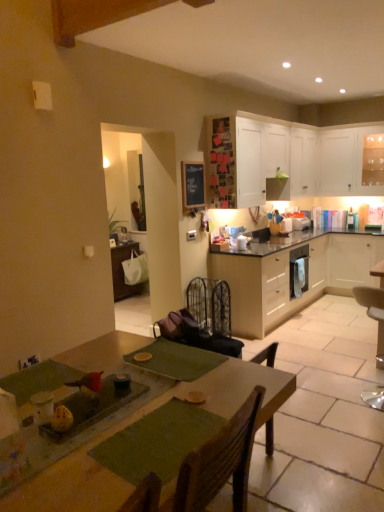
Question: Can you confirm if white glossy microwave at upper right, which is the first appliance in front-to-back order, is taller than white matte cabinet at right, the 3th cabinetry viewed from the top?

Choices:
 (A) yes
 (B) no

Answer: (B)

Question: Considering the relative sizes of white glossy microwave at upper right, which is counted as the second appliance, starting from the back, and white matte cabinet at right, which appears as the second cabinetry when ordered from the bottom, in the image provided, is white glossy microwave at upper right, which is counted as the second appliance, starting from the back, thinner than white matte cabinet at right, which appears as the second cabinetry when ordered from the bottom,?

Choices:
 (A) yes
 (B) no

Answer: (A)

Question: Would you say white glossy microwave at upper right, which is counted as the second appliance, starting from the back, contains white matte cabinet at right, which appears as the second cabinetry when ordered from the bottom?

Choices:
 (A) yes
 (B) no

Answer: (B)

Question: Is white glossy microwave at upper right, which is the first appliance in front-to-back order, bigger than white matte cabinet at right, the 3th cabinetry viewed from the top?

Choices:
 (A) no
 (B) yes

Answer: (A)

Question: Is the position of white glossy microwave at upper right, which is counted as the second appliance, starting from the back, more distant than that of white matte cabinet at right, the 3th cabinetry viewed from the top?

Choices:
 (A) no
 (B) yes

Answer: (B)

Question: Is point (345, 292) positioned closer to the camera than point (294, 219)?

Choices:
 (A) closer
 (B) farther

Answer: (B)

Question: Would you say white matte cabinet at right, the 3th cabinetry viewed from the top, is to the left or to the right of white glossy microwave at upper right, the 1th appliance in the back-to-front sequence, in the picture?

Choices:
 (A) right
 (B) left

Answer: (A)

Question: Relative to white glossy microwave at upper right, the 1th appliance in the back-to-front sequence, is white matte cabinet at right, the 3th cabinetry viewed from the top, in front or behind?

Choices:
 (A) behind
 (B) front

Answer: (B)

Question: Is white matte cabinet at right, the 3th cabinetry viewed from the top, inside the boundaries of white glossy microwave at upper right, the second appliance positioned from the front, or outside?

Choices:
 (A) outside
 (B) inside

Answer: (A)

Question: From the image's perspective, is white glossy microwave at upper right, the 1th appliance in the back-to-front sequence, located above or below green fabric table at center?

Choices:
 (A) below
 (B) above

Answer: (B)

Question: Does point (296, 221) appear closer or farther from the camera than point (56, 499)?

Choices:
 (A) farther
 (B) closer

Answer: (A)

Question: From a real-world perspective, is white glossy microwave at upper right, the second appliance positioned from the front, physically located above or below green fabric table at center?

Choices:
 (A) above
 (B) below

Answer: (A)

Question: Based on their positions, is white glossy microwave at upper right, the 1th appliance in the back-to-front sequence, located to the left or right of green fabric table at center?

Choices:
 (A) right
 (B) left

Answer: (A)

Question: Considering the relative positions of white matte cabinet at upper right, the 1th cabinetry viewed from the top, and black wrought iron armchair at center in the image provided, is white matte cabinet at upper right, the 1th cabinetry viewed from the top, to the left or to the right of black wrought iron armchair at center?

Choices:
 (A) right
 (B) left

Answer: (A)

Question: In terms of size, does white matte cabinet at upper right, which is the 4th cabinetry from bottom to top, appear bigger or smaller than black wrought iron armchair at center?

Choices:
 (A) small
 (B) big

Answer: (B)